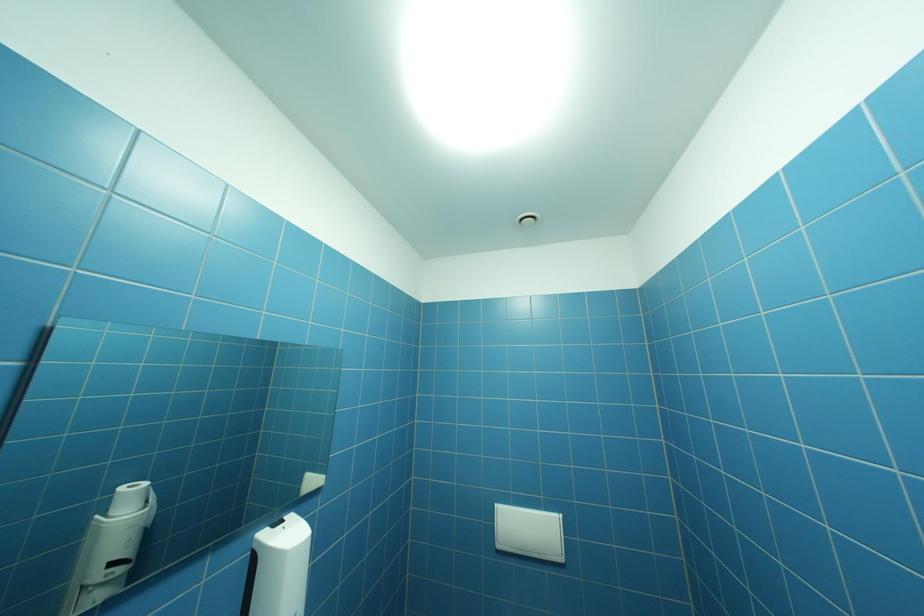
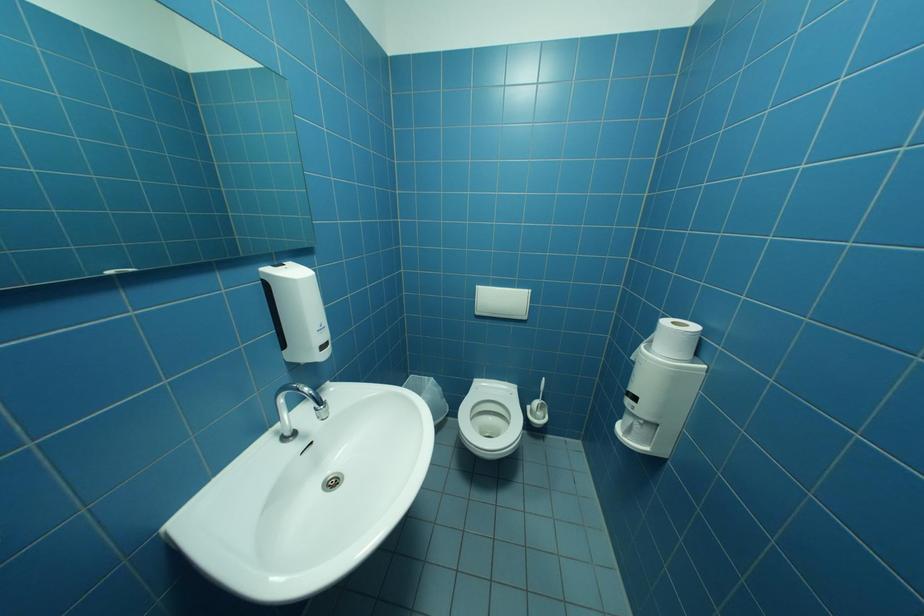
Question: Based on the continuous images, in which direction is the camera rotating? Reply with the corresponding letter.

Choices:
 (A) Left
 (B) Right
 (C) Up
 (D) Down

Answer: (D)